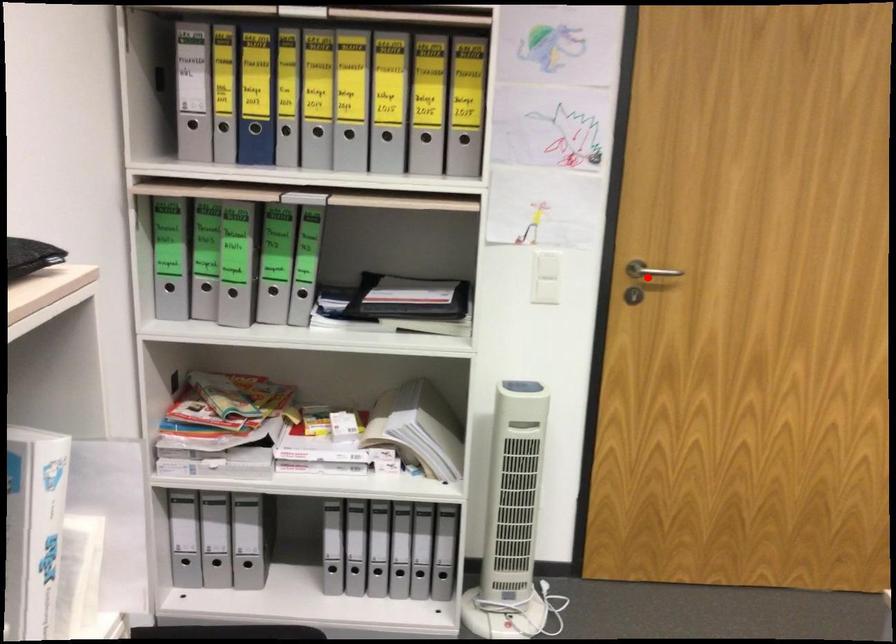
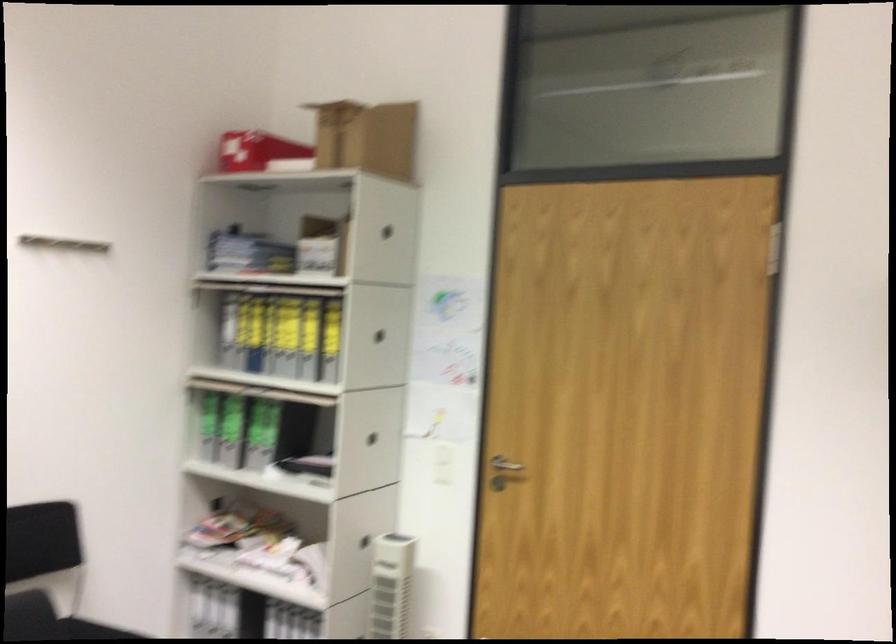
The point at the highlighted location is marked in the first image. Where is the corresponding point in the second image?

(504, 464)